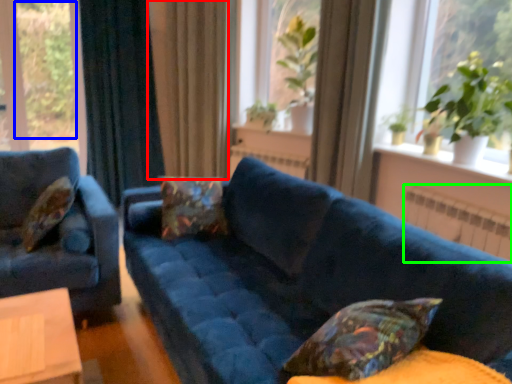
Question: Which object is positioned closest to curtain (highlighted by a red box)? Select from plant (highlighted by a blue box) and radiator (highlighted by a green box).

Choices:
 (A) plant
 (B) radiator

Answer: (B)